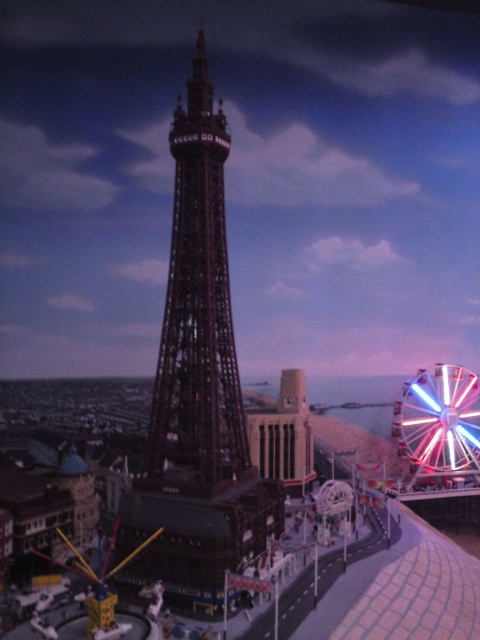
You are a visitor standing at the entrance of the amusement park and want to take a photo of both the shiny metallic carousel at center and the multicolored metallic ferris wheel at lower right. Which object should you position closer to the front of your camera frame to include both in the photo?

To include both the shiny metallic carousel at center and the multicolored metallic ferris wheel at lower right in your photo, you should position the shiny metallic carousel at center closer to the front of your camera frame since it is located below the ferris wheel, meaning it is closer to you.

You are a visitor at the amusement park and want to take a photo of both the shiny metallic carousel at center and the multicolored metallic ferris wheel at lower right. Based on their positions, which one should you place on the left side of your photo to capture both in the frame?

You should place the shiny metallic carousel at center on the left side of your photo since it is already positioned to the left of the multicolored metallic ferris wheel at lower right.